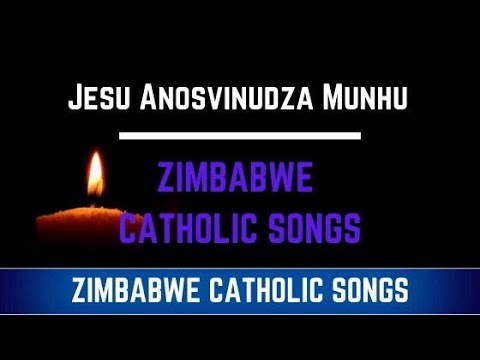
Locate an element on the screen. The height and width of the screenshot is (360, 480). candle is located at coordinates (103, 231).